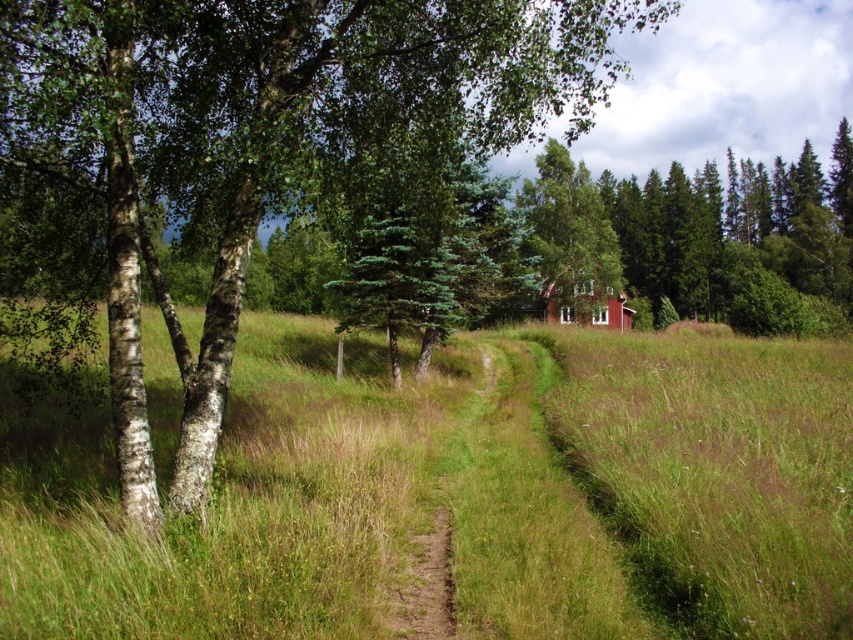
Consider the image. You are standing at the starting point of the dirt path in the rural landscape scene. You want to walk towards the green grassy field at center. In which direction should you head relative to the dirt path?

The green grassy field at center is located at point coordinates of 0.770 on the x axis and 0.540 on the y axis. Since the dirt path is in the foreground and the field is at the center, you should walk forward along the dirt path towards the green grassy field at center.

You are standing at the point with coordinates point (x=596, y=298) and want to walk to the point with coordinates point (x=410, y=600). According to the image, which direction should you face to move towards your destination?

Point (x=410, y=600) is in front of point (x=596, y=298), so you should face forward to move towards your destination.